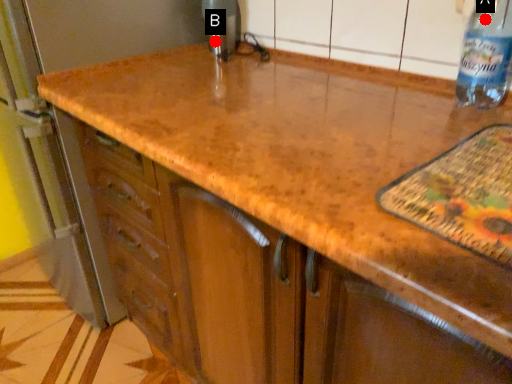
Question: Two points are circled on the image, labeled by A and B beside each circle. Which point is closer to the camera?

Choices:
 (A) A is closer
 (B) B is closer

Answer: (A)